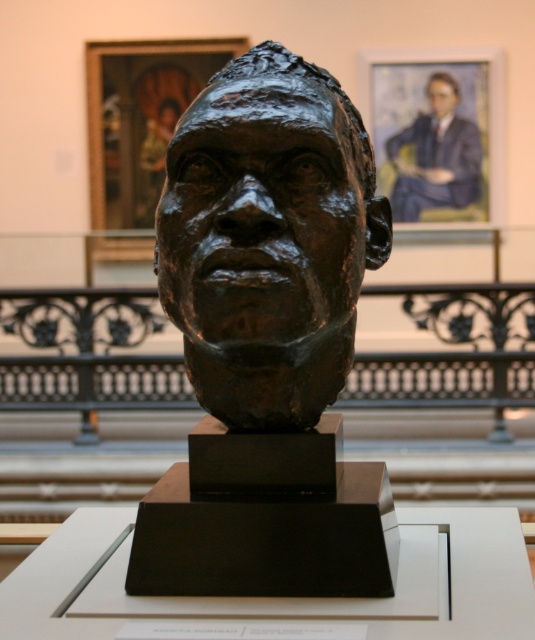
Question: Where is blue suit at upper right located in relation to matte bronze bust at upper center in the image?

Choices:
 (A) right
 (B) left

Answer: (B)

Question: Can you confirm if blue suit at upper right is positioned above matte bronze bust at upper center?

Choices:
 (A) yes
 (B) no

Answer: (B)

Question: Among these objects, which one is farthest from the camera?

Choices:
 (A) blue suit at upper right
 (B) bronze head at center

Answer: (A)

Question: Which of these objects is positioned closest to the bronze head at center?

Choices:
 (A) blue suit at upper right
 (B) matte bronze bust at upper center

Answer: (A)

Question: Estimate the real-world distances between objects in this image. Which object is farther from the blue suit at upper right?

Choices:
 (A) bronze head at center
 (B) matte bronze bust at upper center

Answer: (A)

Question: In this image, where is blue suit at upper right located relative to matte bronze bust at upper center?

Choices:
 (A) below
 (B) above

Answer: (A)